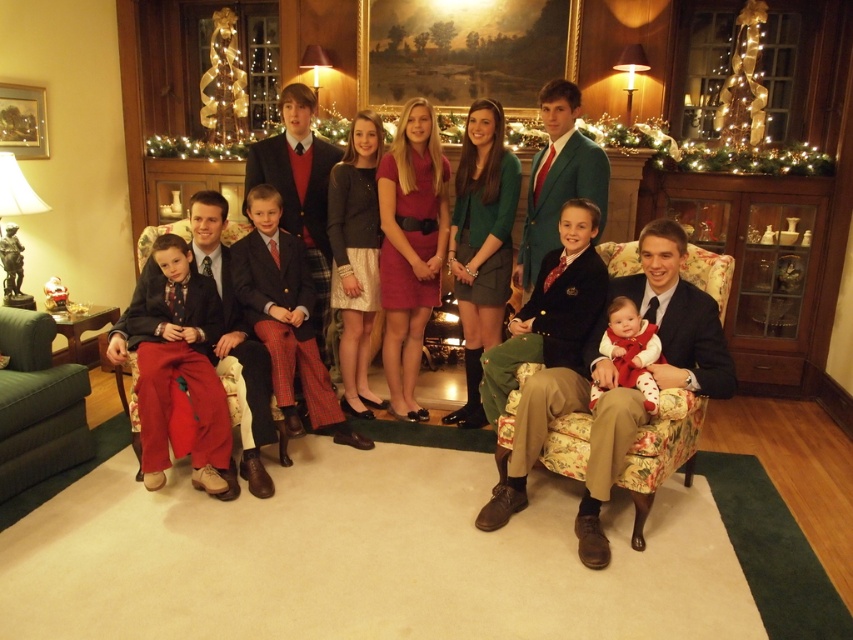
You need to choose between the floral fabric armchair at center and the green fabric armchair at lower left for seating. Which one might have more space for your legs?

The floral fabric armchair at center might be wider than green fabric armchair at lower left, so it could provide more legroom.

You are a photographer setting up for a family photo. You notice the matte red pants at lower left and the green fabric armchair at lower left in the scene. Which object takes up more space in the photo?

The matte red pants at lower left takes up more space in the photo because it is larger in size than the green fabric armchair at lower left.

From the picture: You are a photographer setting up for a family photo in the living room. You need to place a small Christmas tree between the floral fabric armchair at center and the green fabric armchair at lower left. Based on their positions, which armchair should the tree be closer to?

The floral fabric armchair at center is positioned over the green fabric armchair at lower left, so the Christmas tree should be placed closer to the green fabric armchair at lower left to ensure proper alignment with the floor layout.